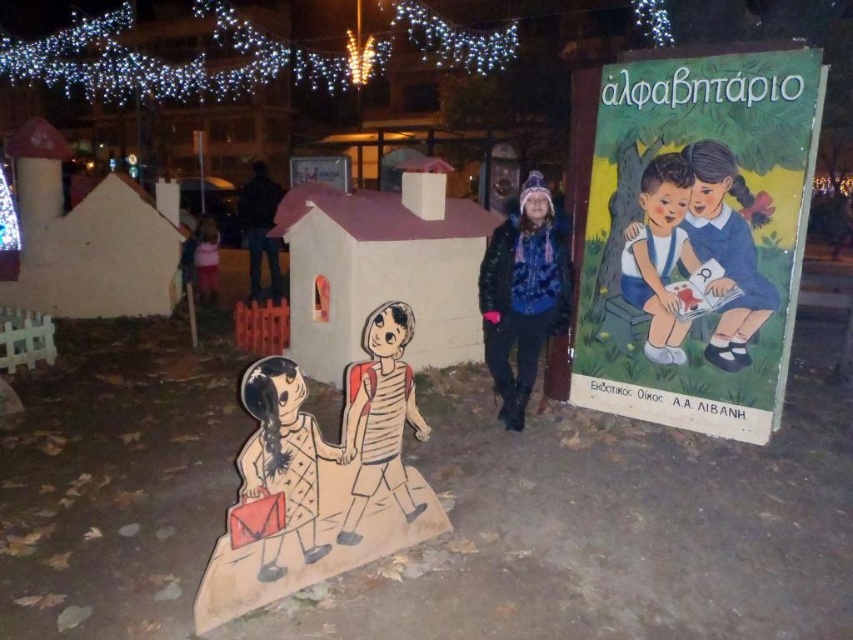
You are a photographer trying to capture a clear photo of the fuzzy black jacket at center and the blue school uniform at right. Since the string lights are casting shadows, which object might be harder to photograph clearly due to its position under the other?

The fuzzy black jacket at center is positioned under the blue school uniform at right, so it might be harder to photograph clearly because it is in shadow from the uniform above.